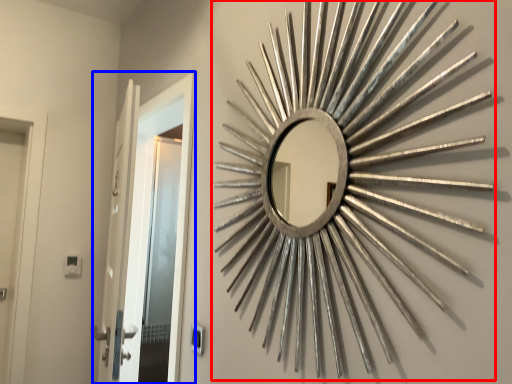
Question: Among these objects, which one is farthest to the camera, brass (highlighted by a red box) or door (highlighted by a blue box)?

Choices:
 (A) brass
 (B) door

Answer: (B)